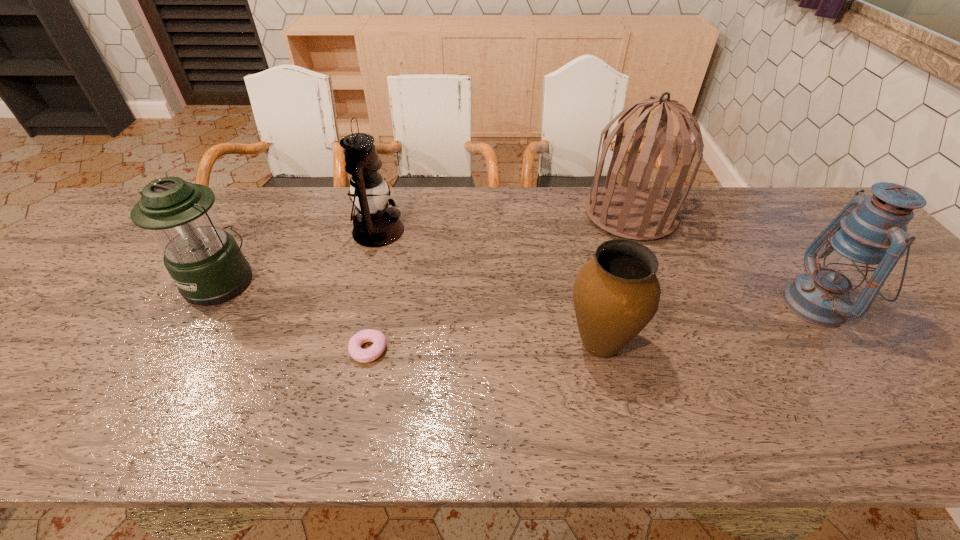
You are a GUI agent. You are given a task and a screenshot of the screen. Output one action in this format:
    pyautogui.click(x=<x>, y=<y>)
    Task: Click on the blank region between the leftmost lantern and the rightmost lantern
    
    Given the screenshot: What is the action you would take?
    pyautogui.click(x=519, y=292)

Locate an element on the screen. Image resolution: width=960 pixels, height=540 pixels. unoccupied area between the urn and the leftmost lantern is located at coordinates (411, 313).

The image size is (960, 540). In order to click on free spot between the doughnut and the leftmost object in this screenshot , I will do `click(295, 315)`.

The height and width of the screenshot is (540, 960). What are the coordinates of `vacant area that lies between the leftmost lantern and the rightmost lantern` in the screenshot? It's located at (519, 292).

Locate an element on the screen. This screenshot has height=540, width=960. free spot between the urn and the rightmost lantern is located at coordinates (708, 325).

Locate an element on the screen. free space between the shortest object and the birdcage is located at coordinates (499, 282).

Identify the location of free space between the birdcage and the leftmost object. point(426,247).

Where is `empty location between the farthest lantern and the shortest object`? empty location between the farthest lantern and the shortest object is located at coordinates (373, 290).

Locate an element on the screen. vacant area between the urn and the doughnut is located at coordinates coord(484,347).

Select which object is the third closest to the rightmost object. Please provide its 2D coordinates. Your answer should be formatted as a tuple, i.e. [(x, y)], where the tuple contains the x and y coordinates of a point satisfying the conditions above.

[(378, 339)]